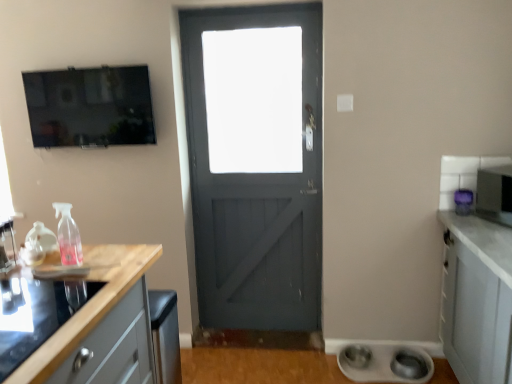
Locate an element on the screen. This screenshot has width=512, height=384. vacant area situated to the left side of white matte bowls at lower right, positioned as the 1th appliance in left-to-right order is located at coordinates (309, 366).